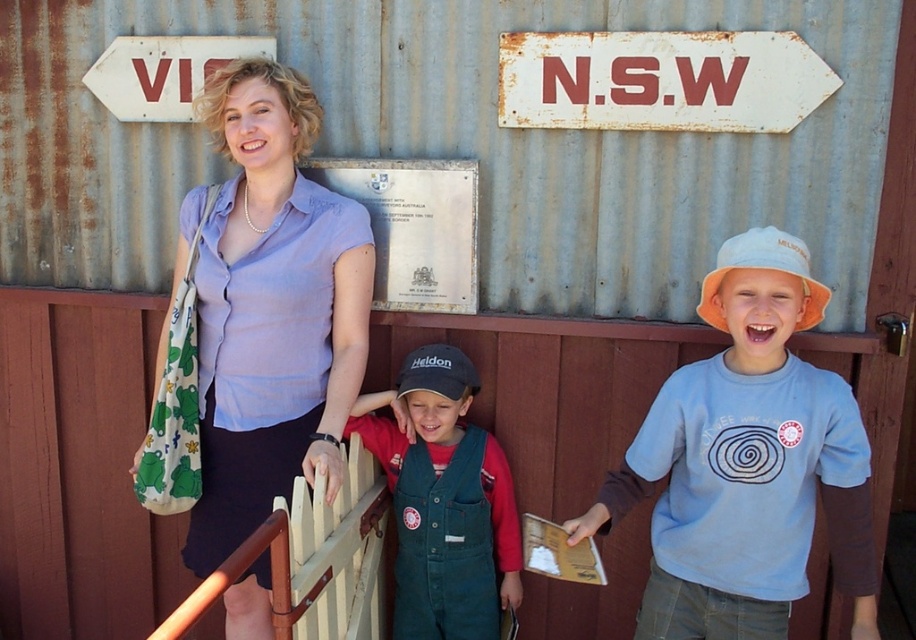
Which is in front, point (334, 518) or point (191, 112)?

Point (334, 518) is more forward.

Is brown wooden rail at center above rusty metal sign at upper left?

No, brown wooden rail at center is not above rusty metal sign at upper left.

Does point (346, 467) lie in front of point (213, 67)?

Yes, point (346, 467) is closer to viewer.

I want to click on brown wooden rail at center, so click(x=311, y=561).

Which of these two, matte purple blouse at center or rusty metal sign at upper left, stands shorter?

rusty metal sign at upper left is shorter.

Is point (346, 292) less distant than point (180, 122)?

Yes, point (346, 292) is closer to viewer.

Is point (285, 435) positioned after point (173, 90)?

No, (285, 435) is in front of (173, 90).

Locate an element on the screen. The width and height of the screenshot is (916, 640). matte purple blouse at center is located at coordinates (255, 321).

The image size is (916, 640). What do you see at coordinates (660, 81) in the screenshot? I see `rusty metal sign at upper center` at bounding box center [660, 81].

I want to click on rusty metal sign at upper center, so click(x=660, y=81).